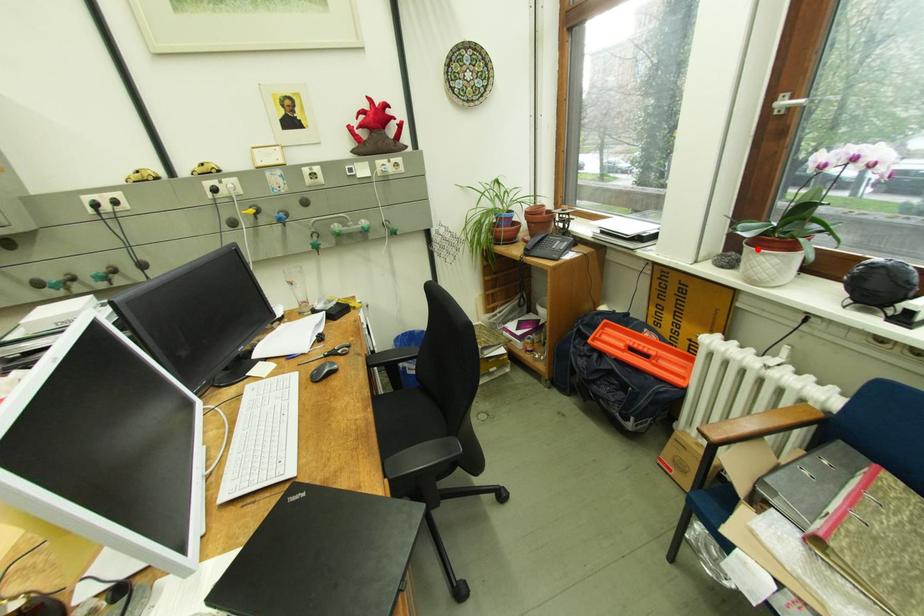
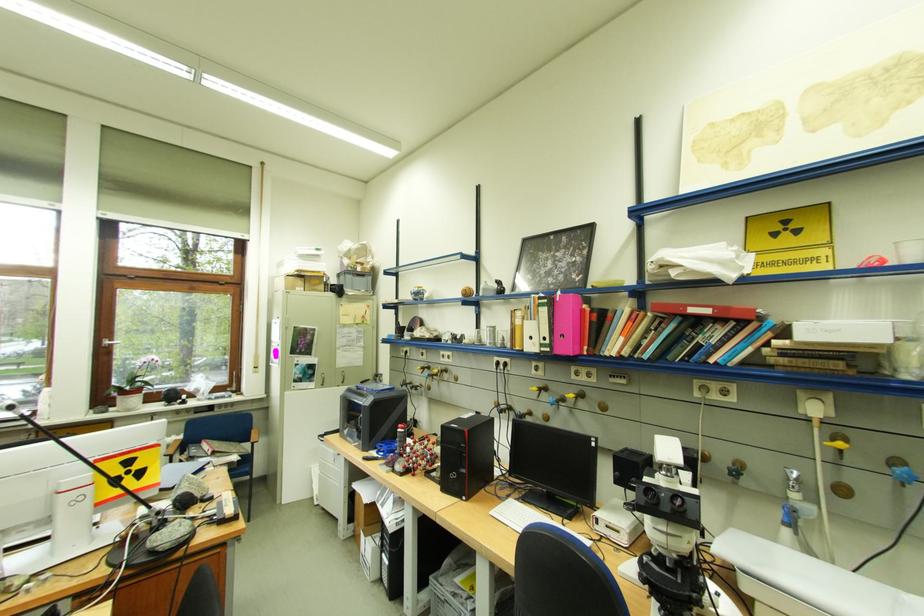
Locate, in the second image, the point that corresponds to the highlighted location in the first image.

(130, 399)